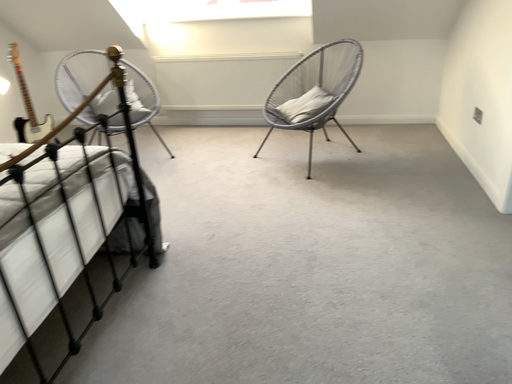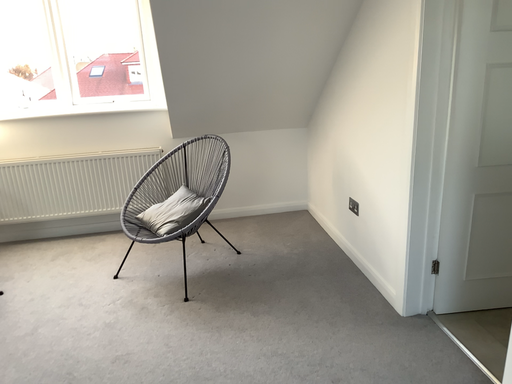
Question: Which way did the camera rotate in the video?

Choices:
 (A) rotated left
 (B) rotated right

Answer: (B)